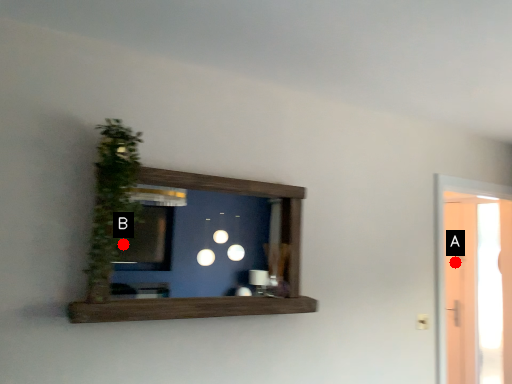
Question: Two points are circled on the image, labeled by A and B beside each circle. Which point is farther from the camera taking this photo?

Choices:
 (A) A is further
 (B) B is further

Answer: (B)